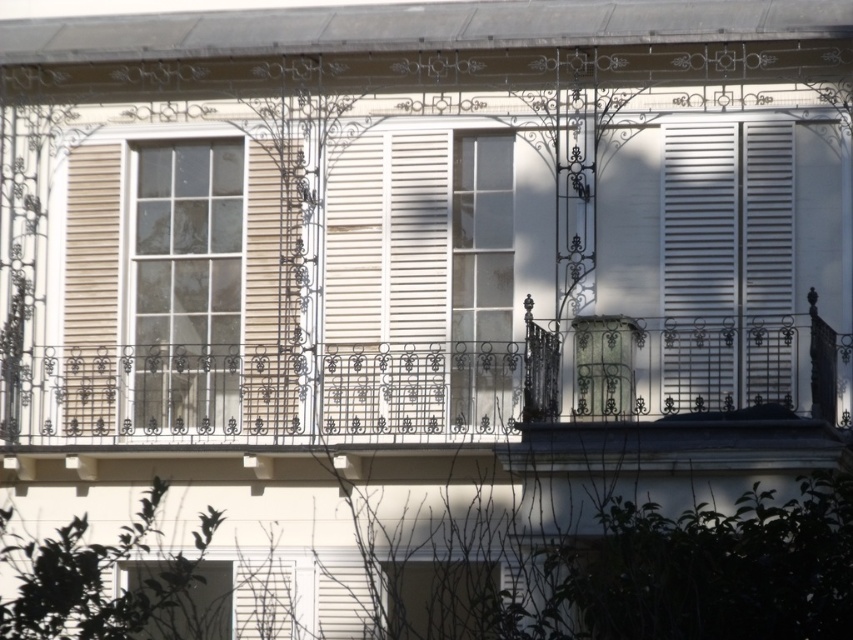
Question: Among these objects, which one is nearest to the camera?

Choices:
 (A) white wrought iron balcony at center
 (B) white matte shutter at right
 (C) white glass window at center
 (D) beige matte shutter at left

Answer: (A)

Question: Which of these objects is positioned closest to the white matte shutters at right?

Choices:
 (A) white glass window at center
 (B) beige matte shutter at left
 (C) white wrought iron balcony at center

Answer: (C)

Question: Which point is farther to the camera?

Choices:
 (A) white glass window at center
 (B) beige matte shutter at left
 (C) white matte shutter at center

Answer: (A)

Question: Does white wrought iron balcony at center lie in front of white matte shutter at right?

Choices:
 (A) yes
 (B) no

Answer: (A)

Question: Is white matte shutters at right above beige matte shutter at left?

Choices:
 (A) yes
 (B) no

Answer: (A)

Question: Can you confirm if beige matte shutter at left is positioned above white matte shutter at right?

Choices:
 (A) no
 (B) yes

Answer: (A)